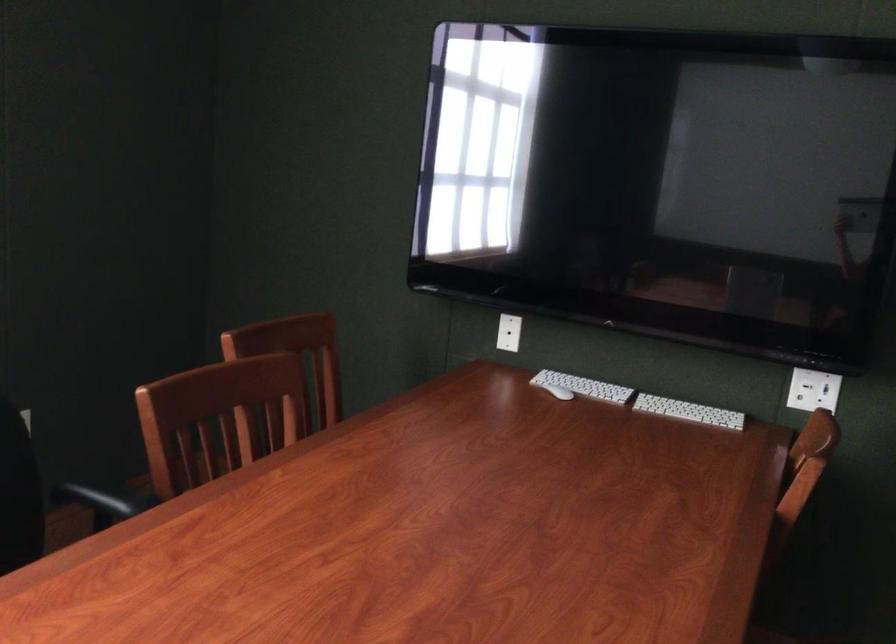
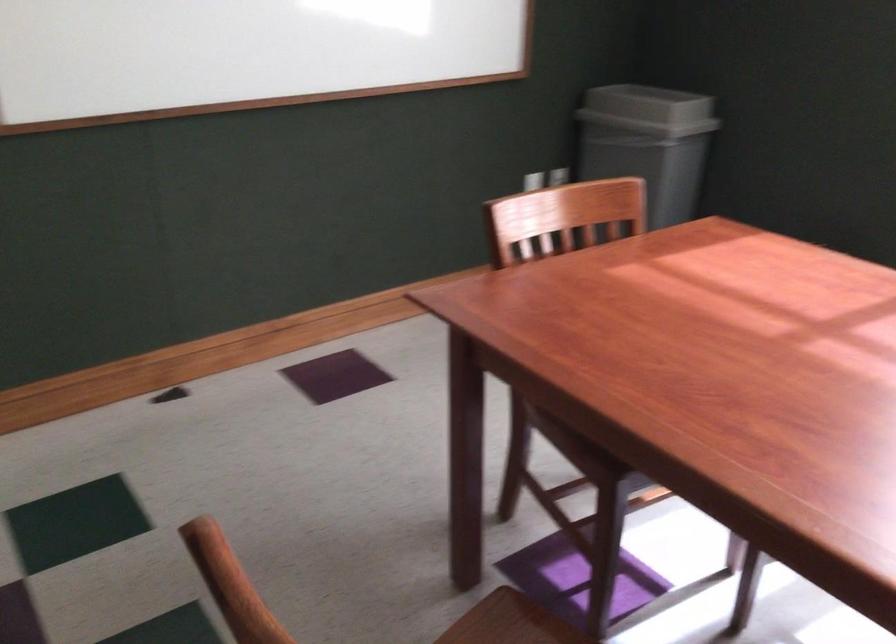
First-person continuous shooting, in which direction is the camera rotating?

The camera rotated toward left-down.